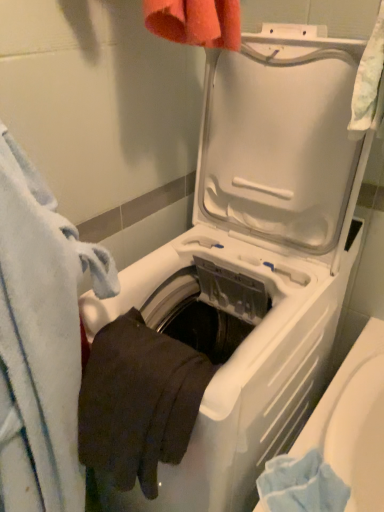
Question: Is point (64, 268) positioned closer to the camera than point (165, 339)?

Choices:
 (A) closer
 (B) farther

Answer: (A)

Question: In terms of height, does blue soft towel at left look taller or shorter compared to dark cotton bath towel at lower left?

Choices:
 (A) short
 (B) tall

Answer: (B)

Question: Considering the positions of blue soft towel at left and dark cotton bath towel at lower left in the image, is blue soft towel at left wider or thinner than dark cotton bath towel at lower left?

Choices:
 (A) wide
 (B) thin

Answer: (A)

Question: From a real-world perspective, relative to blue soft towel at left, is dark cotton bath towel at lower left vertically above or below?

Choices:
 (A) above
 (B) below

Answer: (A)

Question: In the image, is dark cotton bath towel at lower left positioned in front of or behind blue soft towel at left?

Choices:
 (A) front
 (B) behind

Answer: (B)

Question: Looking at their shapes, would you say dark cotton bath towel at lower left is wider or thinner than blue soft towel at left?

Choices:
 (A) thin
 (B) wide

Answer: (A)

Question: Considering the positions of point (x=168, y=457) and point (x=54, y=205), is point (x=168, y=457) closer or farther from the camera than point (x=54, y=205)?

Choices:
 (A) farther
 (B) closer

Answer: (A)